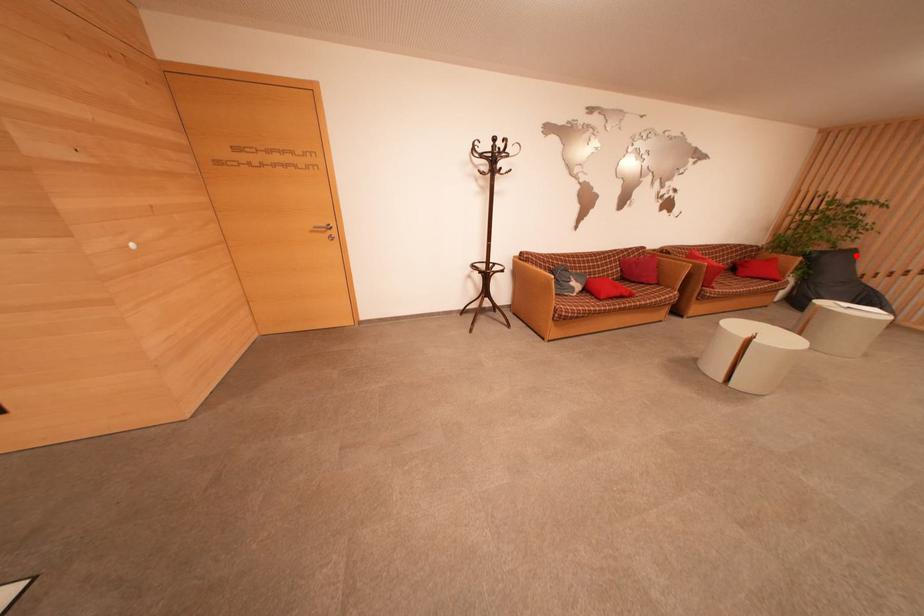
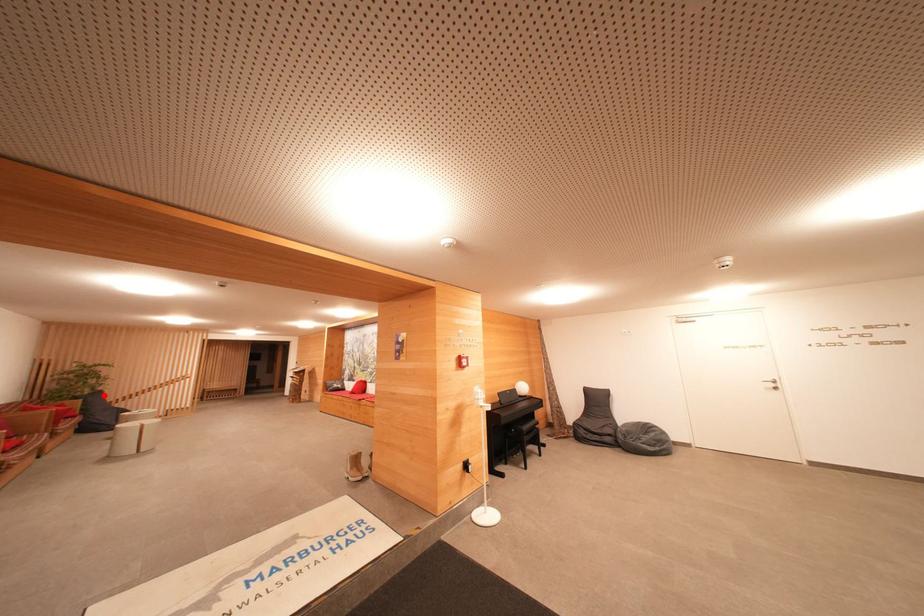
I am providing you with two images of the same scene from different viewpoints. A red point is marked on the first image and another point is marked on the second image. Does the point marked in image1 correspond to the same location as the one in image2?

Yes